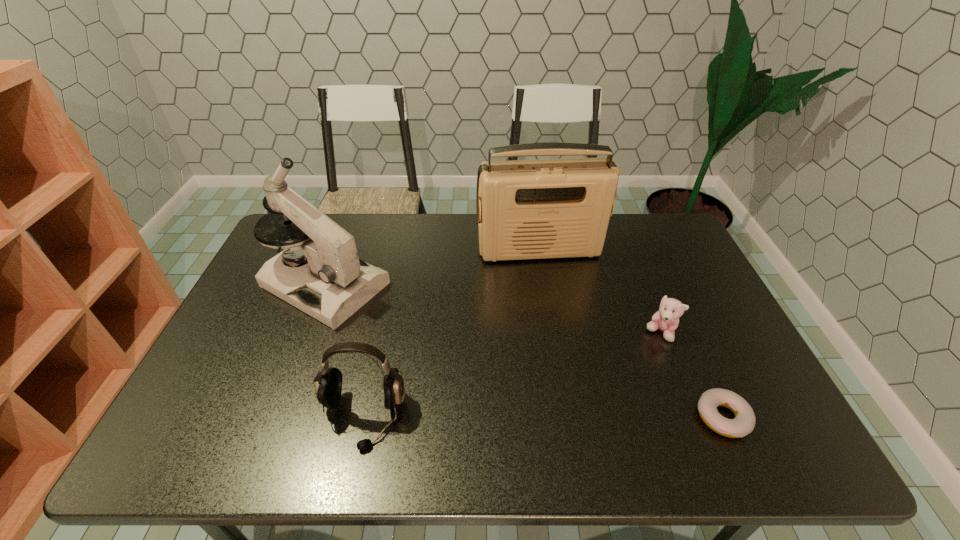
The height and width of the screenshot is (540, 960). What are the coordinates of `the third tallest object` in the screenshot? It's located at (328, 387).

Where is `doughnut`? The height and width of the screenshot is (540, 960). doughnut is located at coordinates (744, 422).

Find the location of a particular element. The height and width of the screenshot is (540, 960). microscope is located at coordinates (335, 283).

This screenshot has height=540, width=960. I want to click on the second shortest object, so click(x=666, y=319).

This screenshot has height=540, width=960. I want to click on radio receiver, so click(x=550, y=208).

Locate an element on the screen. free space located on the left of the shortest object is located at coordinates (614, 417).

The width and height of the screenshot is (960, 540). I want to click on free space located at the eyepiece of the microscope, so click(x=431, y=339).

At what (x,y) coordinates should I click in order to perform the action: click on vacant area located at the eyepiece of the microscope. Please return your answer as a coordinate pair (x, y). The width and height of the screenshot is (960, 540). Looking at the image, I should click on (434, 340).

You are a GUI agent. You are given a task and a screenshot of the screen. Output one action in this format:
    pyautogui.click(x=<x>, y=<y>)
    Task: Click on the vacant space located 0.230m at the eyepiece of the microscope
    The height and width of the screenshot is (540, 960).
    Given the screenshot: What is the action you would take?
    pyautogui.click(x=437, y=341)

This screenshot has height=540, width=960. I want to click on vacant space located 0.180m at the face of the teddy bear, so pos(600,366).